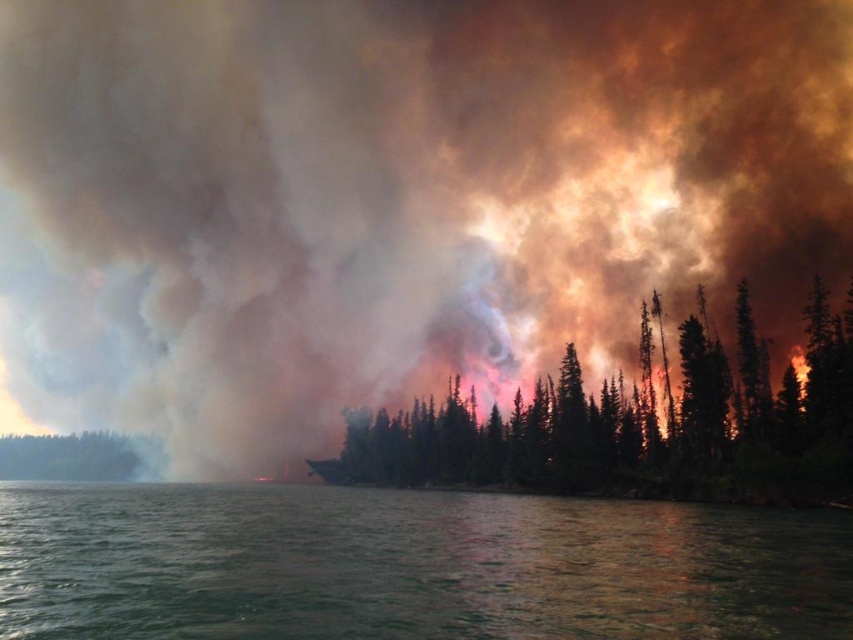
You are a firefighter trying to assess the situation. From your vantage point, can you see the green leafy trees at center through the green water at lower center?

The green water at lower center is positioned over green leafy trees at center, so the trees are obscured by the water and cannot be seen through it.

You are a firefighter assessing the fire scene. You notice the green leafy trees at center and the green matte tree at left. Which tree has a wider spread of branches? Please base your answer on their visual appearance in the image.

The green leafy trees at center has a wider spread of branches than the green matte tree at left, as its width is larger according to the description.